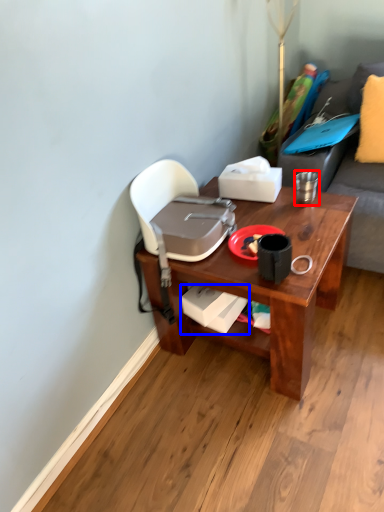
Question: Which object appears farthest to the camera in this image, coffee cup (highlighted by a red box) or box (highlighted by a blue box)?

Choices:
 (A) coffee cup
 (B) box

Answer: (A)